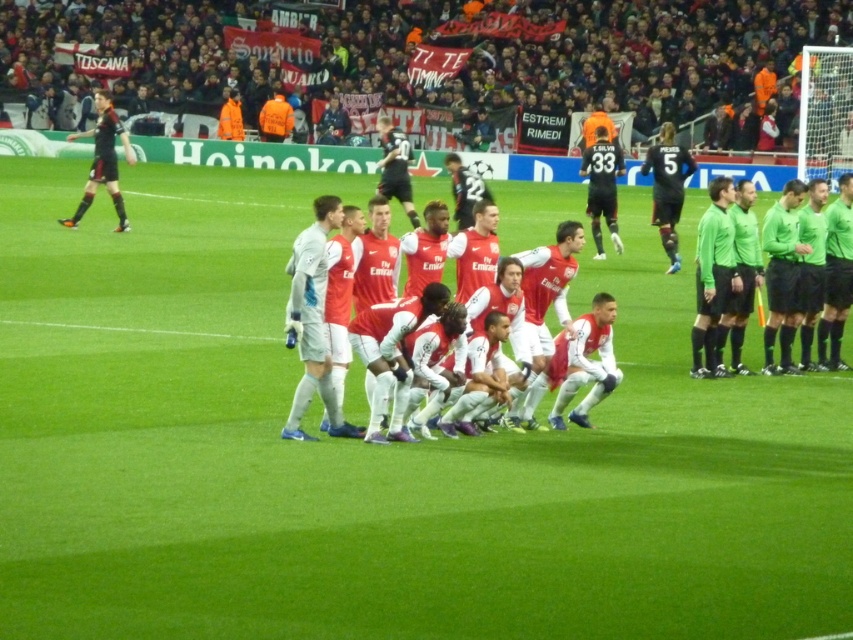
You are a photographer at the soccer match and want to capture a photo of the two groups of players wearing matte black jersey at left and black jersey at center. Which group should you focus on if you want to highlight the wider players?

The matte black jersey at left is wider than the black jersey at center, so focusing on the matte black jersey at left will highlight the wider players.

From the picture: You are a photographer at the soccer match. You need to capture a photo that includes both the white matte jersey at center and the matte black jersey at left. Based on their positions, which jersey is positioned lower in the frame?

The white matte jersey at center is positioned below the matte black jersey at left, so it is lower in the frame.

You are a photographer at the soccer match and want to capture a photo of the white matte jersey at center. The stadium has a rule that you can only take photos from the point at coordinates [312,321]. Is this point the correct location to take the photo?

Yes, the white matte jersey at center is located at point [312,321], so taking the photo from this point will capture the subject correctly.